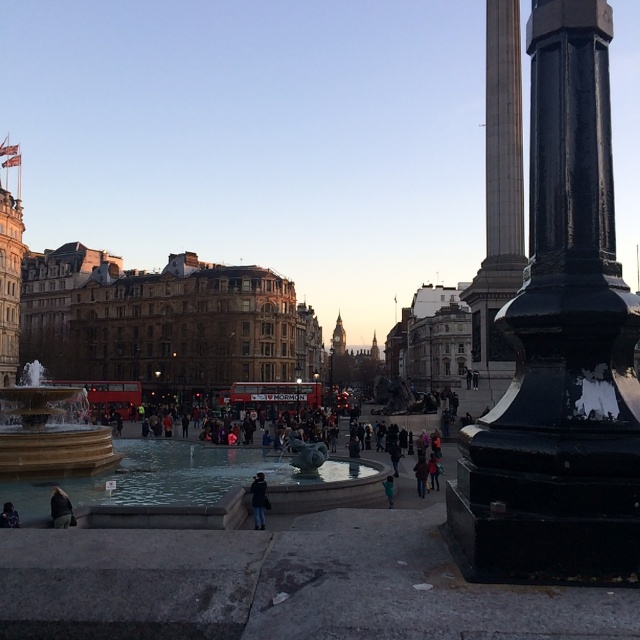
You are standing in Trafalgar Square and see a person wearing dark blue jeans at center. If you want to take a photo of them without including the large black column on the right, where should you position yourself relative to the person?

You should position yourself to the left of the person wearing dark blue jeans at center to avoid including the large black column on the right in your photo.

Consider the image. You are standing in Trafalgar Square and want to take a photo of both the ornate black column on the right and the fountain in the midground. You notice two points marked in the scene. One is at coordinates point [509,416] and the other at point [387,504]. Which of these points is closer to your camera position?

Point [509,416] is closer to the camera than point [387,504].